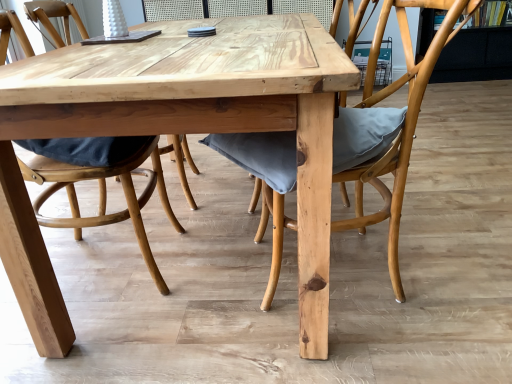
This screenshot has width=512, height=384. Identify the location of free region under matte gray cushion at center, which is the first chair in right-to-left order (from a real-world perspective). (364, 263).